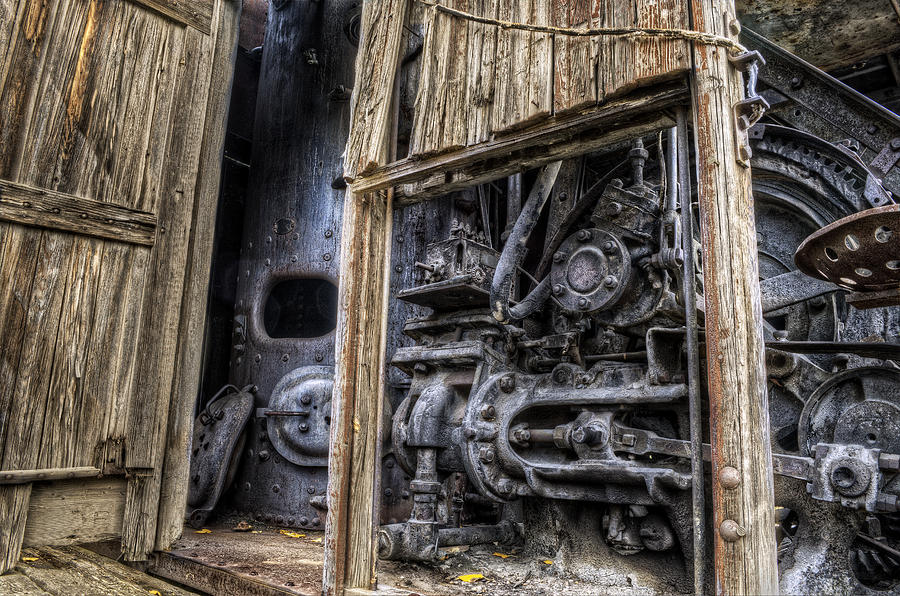
You are a GUI agent. You are given a task and a screenshot of the screen. Output one action in this format:
    pyautogui.click(x=<x>, y=<y>)
    Task: Click on the wooden post right of opening
    
    Given the screenshot: What is the action you would take?
    pyautogui.click(x=734, y=344)